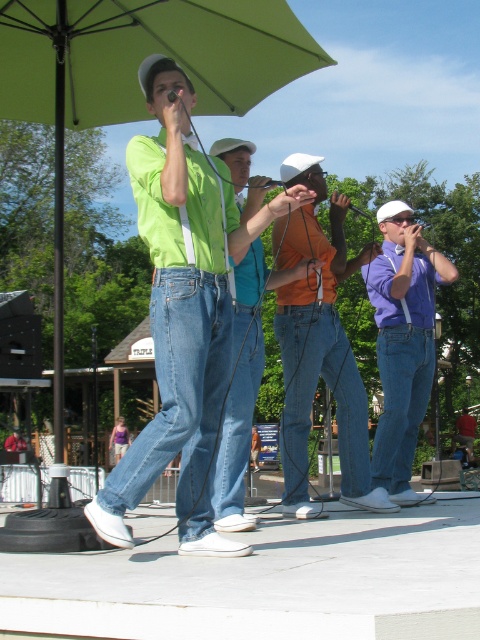
You are a photographer trying to capture a clear shot of the orange matte shirt at center without the green fabric umbrella at upper center blocking it. What adjustment should you make to your camera position?

Move your camera position backward to create more distance between the green fabric umbrella at upper center and the orange matte shirt at center. Since the green fabric umbrella at upper center is closer to the viewer than the orange matte shirt at center, moving back will reduce the umbrella blocking the shirt.

You are a photographer standing at the back of the stage. You want to take a photo of the orange matte shirt at center. Where should you aim your camera?

You should aim your camera at point 0.542 on the horizontal axis and 0.665 on the vertical axis to capture the orange matte shirt at center.